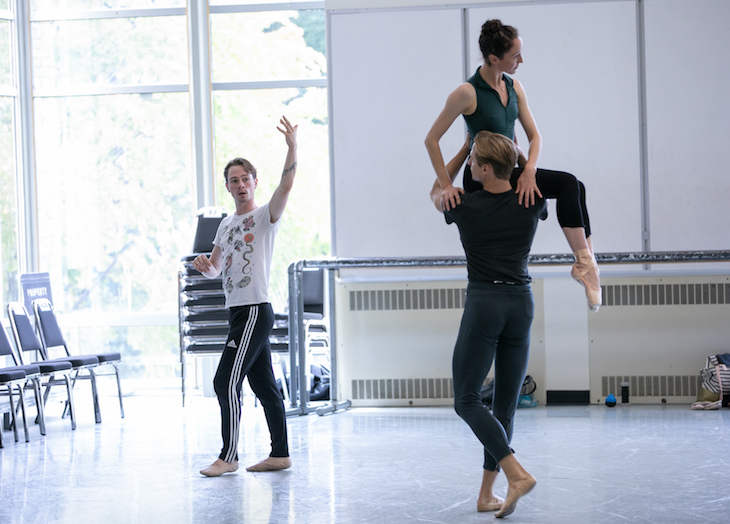
Find the location of a particular element. The image size is (730, 524). chairs stacked in a pile on top of one another is located at coordinates (199, 350), (198, 334), (201, 315), (199, 301), (198, 289), (188, 274), (206, 247), (283, 349), (282, 334), (285, 318).